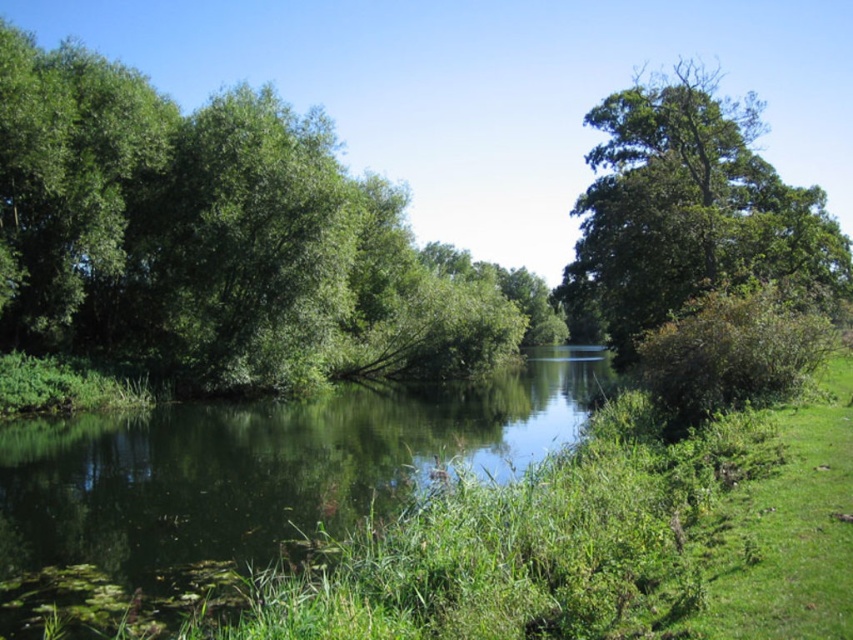
Question: Among these points, which one is farthest from the camera?

Choices:
 (A) (807, 225)
 (B) (254, 298)
 (C) (134, 474)

Answer: (A)

Question: Does green grassy river at center appear on the right side of green leafy tree at upper right?

Choices:
 (A) yes
 (B) no

Answer: (B)

Question: Is green leafy tree at left positioned behind green leafy tree at upper right?

Choices:
 (A) no
 (B) yes

Answer: (B)

Question: Is green grassy river at center positioned behind green leafy tree at upper right?

Choices:
 (A) yes
 (B) no

Answer: (B)

Question: Which point is closer to the camera?

Choices:
 (A) green leafy tree at upper right
 (B) green grassy river at center
 (C) green leafy tree at left

Answer: (B)

Question: Estimate the real-world distances between objects in this image. Which object is closer to the green leafy tree at left?

Choices:
 (A) green grassy river at center
 (B) green leafy tree at upper right

Answer: (A)